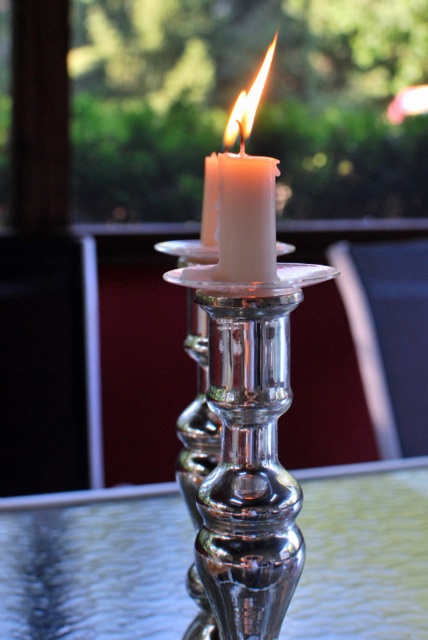
Question: Does bright yellow flame at center come behind white wax candle at center?

Choices:
 (A) no
 (B) yes

Answer: (A)

Question: Does shiny metallic candle holder at center have a smaller size compared to white wax candle at center?

Choices:
 (A) no
 (B) yes

Answer: (A)

Question: Considering the relative positions of silver metallic table at center and shiny metallic candle holder at center in the image provided, where is silver metallic table at center located with respect to shiny metallic candle holder at center?

Choices:
 (A) left
 (B) right

Answer: (B)

Question: Which of the following is the farthest from the observer?

Choices:
 (A) tap(163, 250)
 (B) tap(115, 563)

Answer: (B)

Question: Which object appears farthest from the camera in this image?

Choices:
 (A) white wax candle at center
 (B) silver metallic table at center
 (C) shiny metallic candle holder at center

Answer: (B)

Question: Which is nearer to the silver metallic table at center?

Choices:
 (A) shiny metallic candle holder at center
 (B) bright yellow flame at center

Answer: (A)